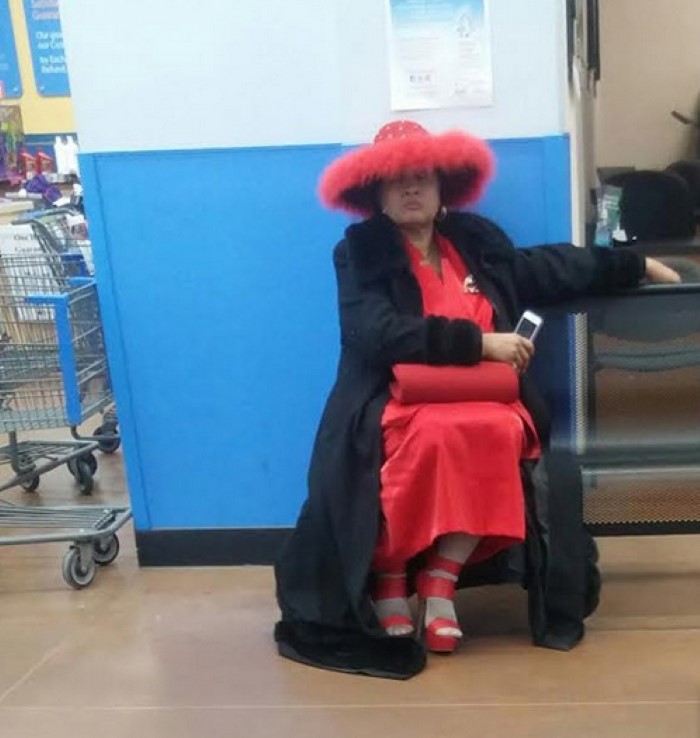
Identify the location of poster. This screenshot has height=738, width=700. 444,38.